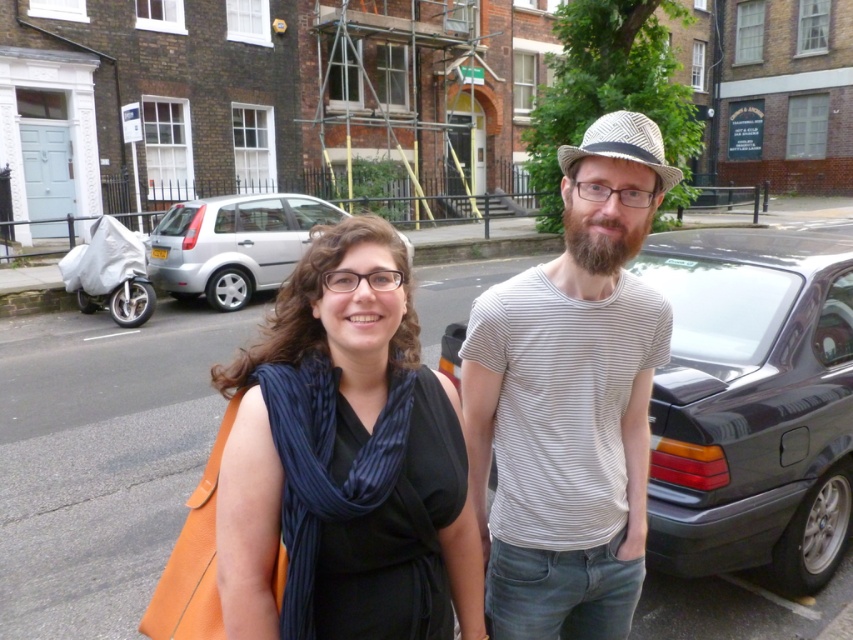
Is striped cotton t-shirt at center above dark gray metallic car at right?

Correct, striped cotton t-shirt at center is located above dark gray metallic car at right.

Which of these two, striped cotton t-shirt at center or dark gray metallic car at right, stands taller?

With more height is striped cotton t-shirt at center.

The width and height of the screenshot is (853, 640). Find the location of `striped cotton t-shirt at center`. striped cotton t-shirt at center is located at coordinates (570, 401).

Is point (508, 300) in front of point (194, 241)?

Yes, it is.

Is striped cotton t-shirt at center closer to the viewer compared to silver metallic hatchback at center-left?

Yes, striped cotton t-shirt at center is closer to the viewer.

Between point (602, 392) and point (236, 218), which one is positioned behind?

Point (236, 218)

Image resolution: width=853 pixels, height=640 pixels. In order to click on striped cotton t-shirt at center in this screenshot , I will do `click(570, 401)`.

Who is higher up, dark gray metallic car at right or silver metallic hatchback at center-left?

silver metallic hatchback at center-left

This screenshot has width=853, height=640. Identify the location of dark gray metallic car at right. (752, 403).

Between point (747, 314) and point (318, 209), which one is positioned behind?

Point (318, 209)

In order to click on dark gray metallic car at right in this screenshot , I will do `click(752, 403)`.